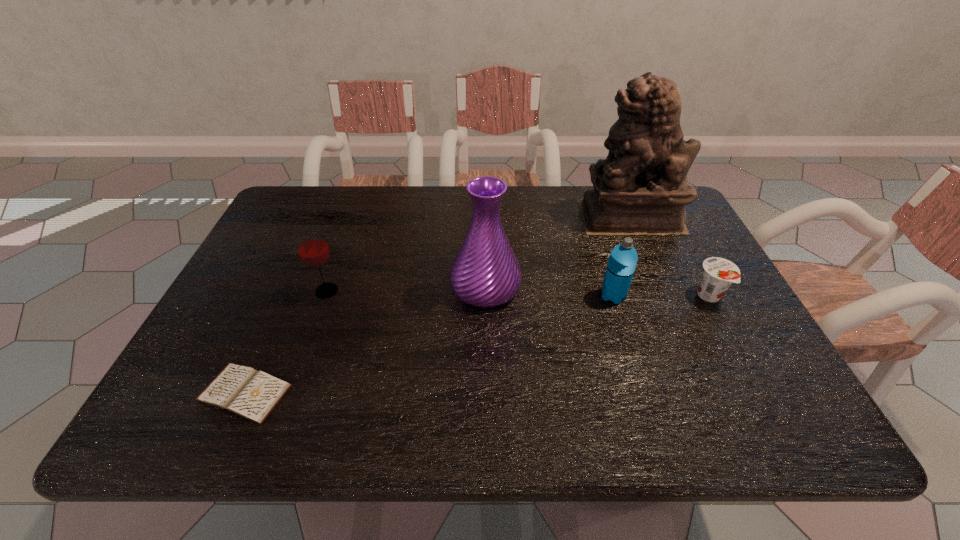
Find the location of a particular element. sculpture that is at the right edge is located at coordinates (641, 188).

In order to click on yogurt that is at the right edge in this screenshot , I will do `click(718, 274)`.

I want to click on object at the near left corner, so click(251, 394).

Where is `object positioned at the far right corner`? Image resolution: width=960 pixels, height=540 pixels. object positioned at the far right corner is located at coordinates (641, 188).

Find the location of `vacant point at the far edge`. vacant point at the far edge is located at coordinates (465, 197).

Identify the location of vacant space at the near edge of the desktop. (481, 424).

At what (x,y) coordinates should I click in order to perform the action: click on free space at the left edge of the desktop. Please return your answer as a coordinate pair (x, y). The height and width of the screenshot is (540, 960). Looking at the image, I should click on click(257, 280).

I want to click on free region at the right edge of the desktop, so click(x=672, y=239).

Identify the location of free space at the far left corner of the desktop. (335, 187).

Find the location of a particular element. free spot between the diary and the thermos bottle is located at coordinates (429, 344).